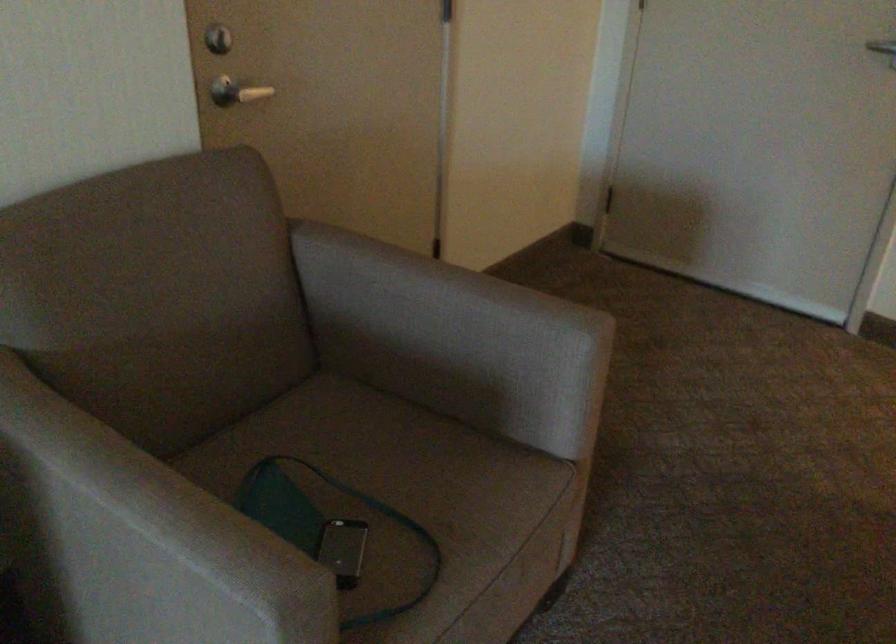
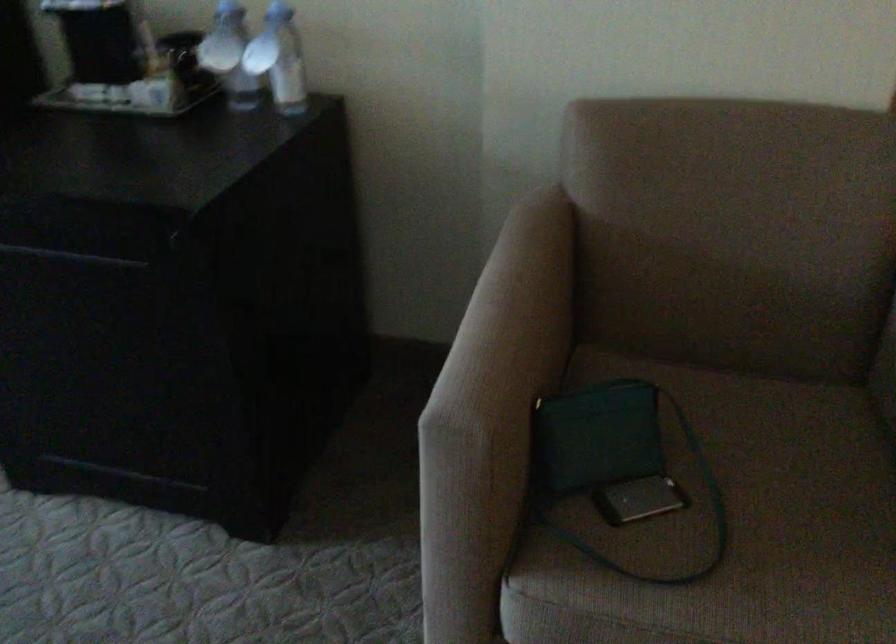
Where in the second image is the point corresponding to the point at 280,544 from the first image?

(495, 390)